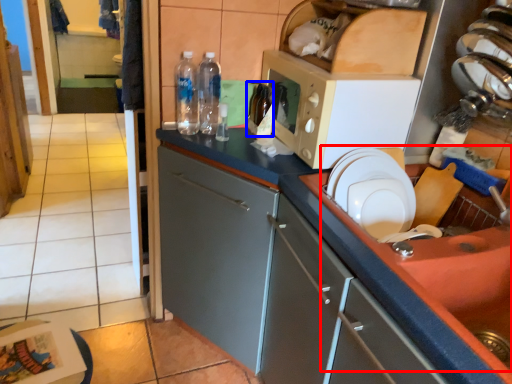
Question: Which object is closer to the camera taking this photo, sink (highlighted by a red box) or bottle (highlighted by a blue box)?

Choices:
 (A) sink
 (B) bottle

Answer: (A)